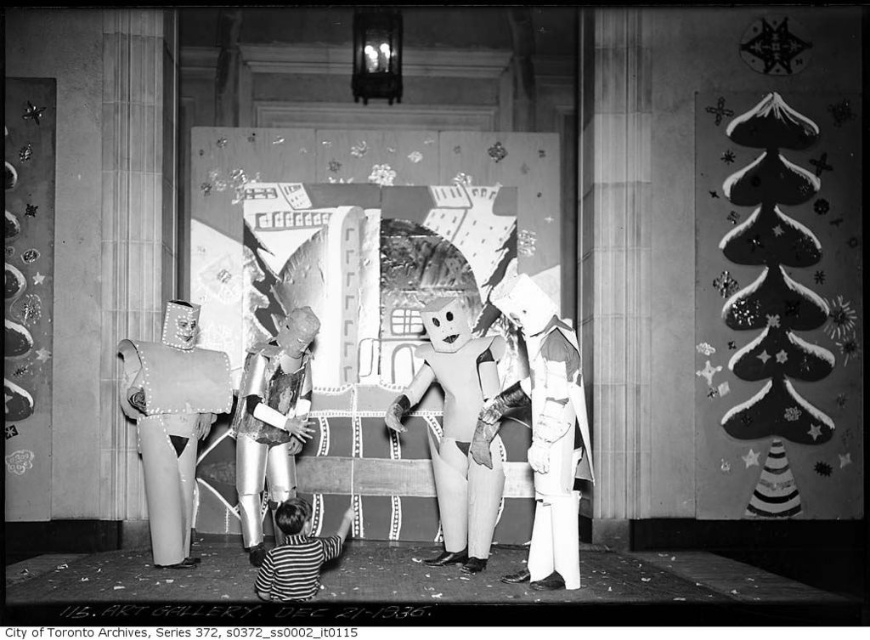
Consider the image. You are a stage designer preparing for a play. You have a black paper christmas tree at right and a cardboard robot at center. Which object is wider?

The black paper christmas tree at right is wider than the cardboard robot at center.

You are a photographer standing at the back of the Art Gallery of Toronto, where a childrens performance is taking place. You want to take a photo of the striped cotton shirt at lower center but also want the smooth cardboard robot at left to be visible in the frame. Based on their positions, will you be able to capture both in the same photo?

The smooth cardboard robot at left is further to the viewer than the striped cotton shirt at lower center, so yes, you can capture both in the same photo as the robot is closer to you and the shirt is behind it within the frame.

You are a photographer at the Art Gallery of Toronto. You need to capture a photo of the shiny silver robot at center and the black paper christmas tree at right. Which object should you focus on first if you want to ensure both are in frame without moving the camera?

The black paper christmas tree at right is located above the shiny silver robot at center. Therefore, focusing on the shiny silver robot at center first will ensure the black paper christmas tree at right is still within the frame since it is positioned above it.